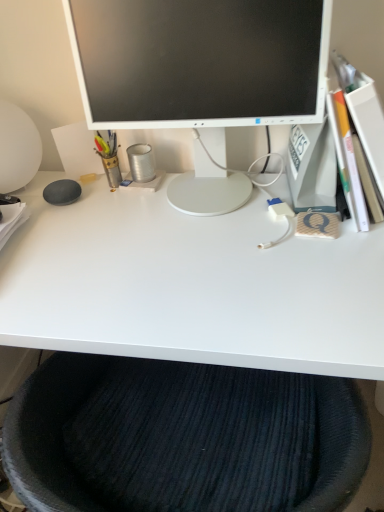
Image resolution: width=384 pixels, height=512 pixels. I want to click on vacant space in front of metallic canister at center, which is the first stationery in right-to-left order, so click(162, 197).